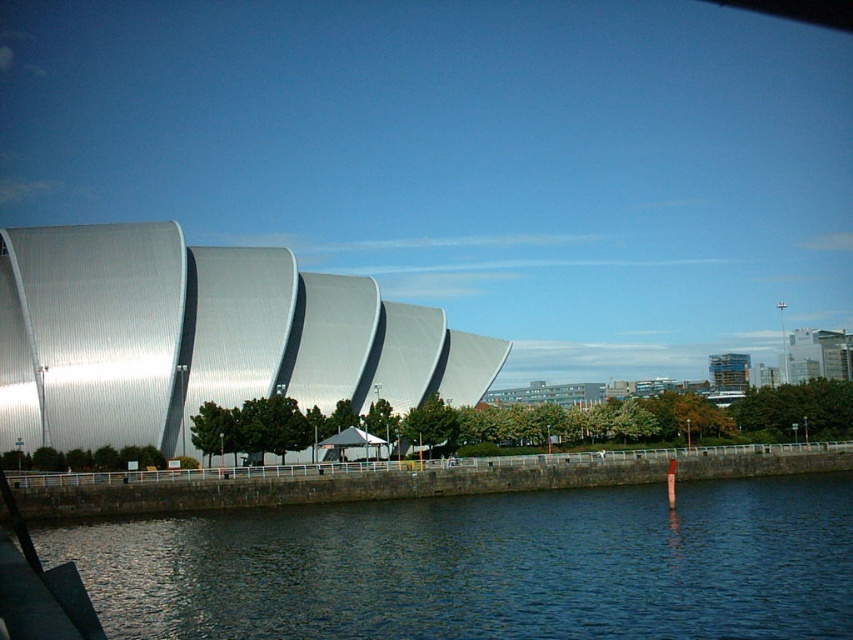
Does dark blue water at lower center lie behind shiny metallic building at left?

No, it is not.

Does point (198, 570) come in front of point (80, 259)?

Yes.

Is point (746, 620) positioned before point (306, 273)?

Yes, it is.

Locate an element on the screen. dark blue water at lower center is located at coordinates (485, 566).